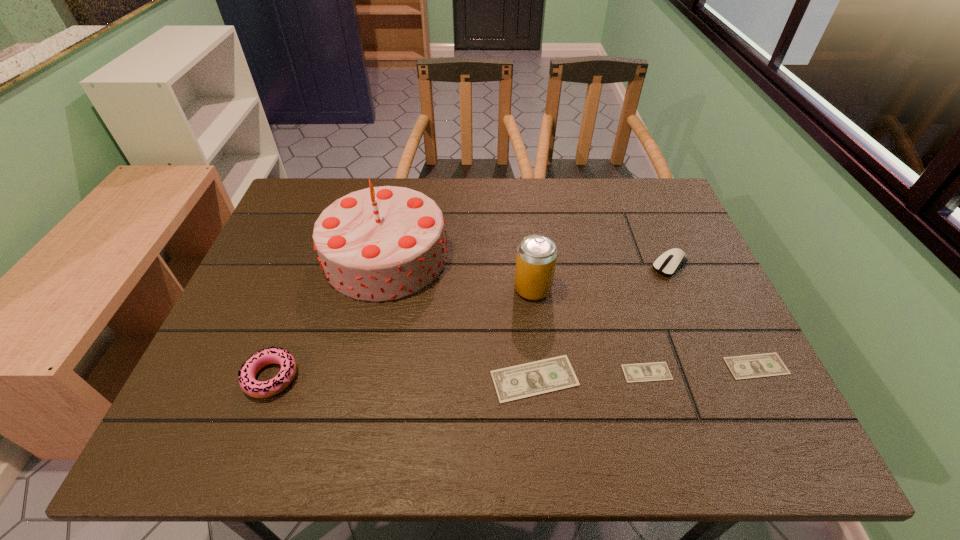
The image size is (960, 540). In order to click on vacant space situated 0.100m on the back of the leftmost money in this screenshot , I will do `click(529, 320)`.

The height and width of the screenshot is (540, 960). Find the location of `blank space located on the back of the shortest object`. blank space located on the back of the shortest object is located at coordinates coord(636,340).

Locate an element on the screen. vacant area located on the left of the second shortest object is located at coordinates (662, 366).

What are the coordinates of `vacant region located 0.060m on the left of the mouse` in the screenshot? It's located at pyautogui.click(x=629, y=265).

What are the coordinates of `vacant space positioned 0.160m on the right of the tallest object` in the screenshot? It's located at (506, 255).

This screenshot has width=960, height=540. I want to click on vacant space located on the right of the pop (soda), so click(637, 288).

This screenshot has width=960, height=540. I want to click on vacant area situated on the right of the doughnut, so click(x=452, y=377).

Image resolution: width=960 pixels, height=540 pixels. Find the location of `object that is at the far edge`. object that is at the far edge is located at coordinates (382, 243).

I want to click on doughnut that is at the near edge, so click(x=258, y=389).

The image size is (960, 540). What are the coordinates of `object present at the left edge` in the screenshot? It's located at (258, 389).